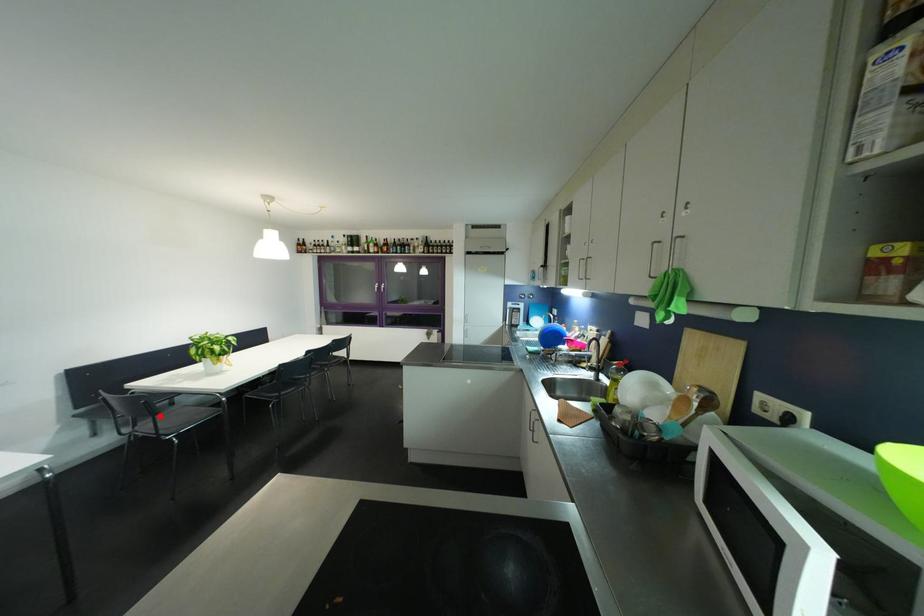
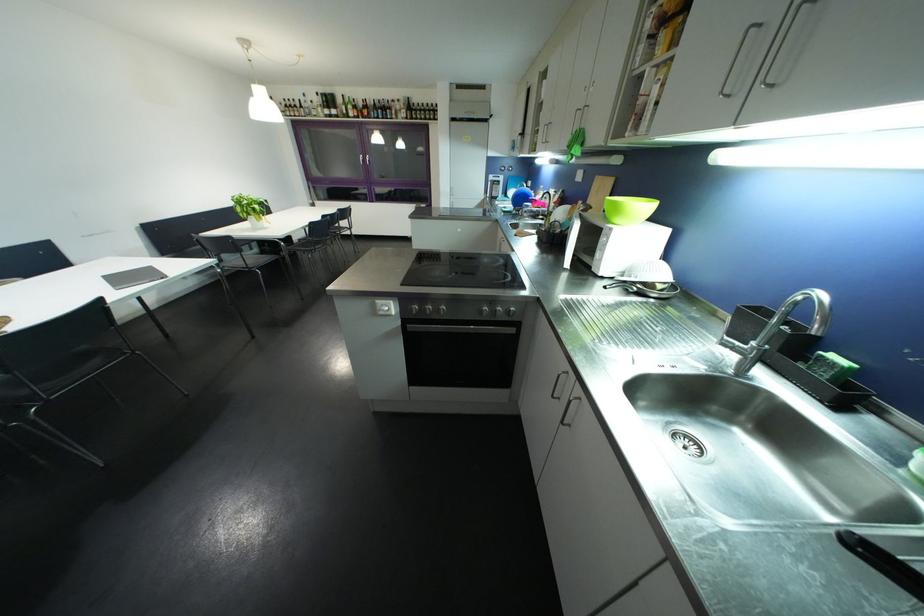
Question: A red point is marked in image1. In image2, is the corresponding 3D point closer to the camera or farther? Reply with the corresponding letter.

Choices:
 (A) The corresponding 3D point is closer.
 (B) The corresponding 3D point is farther.

Answer: (A)